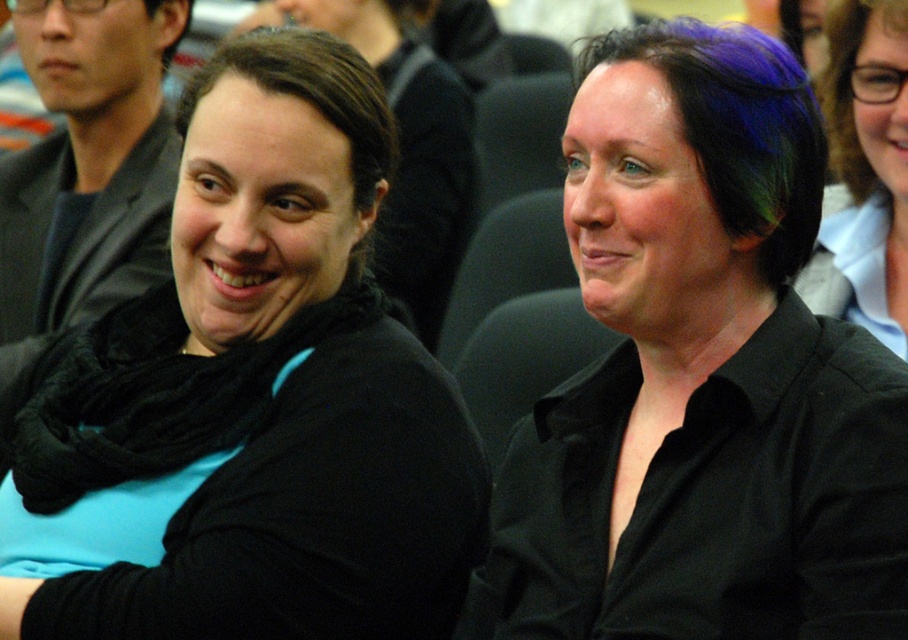
Can you confirm if black matte shirt at center is positioned above brown curly hair at upper right?

Actually, black matte shirt at center is below brown curly hair at upper right.

Does black matte shirt at center come in front of brown curly hair at upper right?

Yes, black matte shirt at center is closer to the viewer.

Where is `black matte shirt at center`? The image size is (908, 640). black matte shirt at center is located at coordinates (699, 378).

Where is `black matte shirt at center`? This screenshot has width=908, height=640. black matte shirt at center is located at coordinates (699, 378).

Between point (902, 461) and point (808, 92), which one is positioned behind?

The point (808, 92) is behind.

At what (x,y) coordinates should I click in order to perform the action: click on black matte shirt at center. Please return your answer as a coordinate pair (x, y). Looking at the image, I should click on (699, 378).

Does black matte scarf at left appear on the right side of purple dyed hair at upper right?

Incorrect, black matte scarf at left is not on the right side of purple dyed hair at upper right.

From the picture: Can you confirm if black matte scarf at left is smaller than purple dyed hair at upper right?

No, black matte scarf at left is not smaller than purple dyed hair at upper right.

Is point (333, 620) in front of point (682, 90)?

No, (333, 620) is further to viewer.

This screenshot has height=640, width=908. I want to click on black matte scarf at left, so click(267, 388).